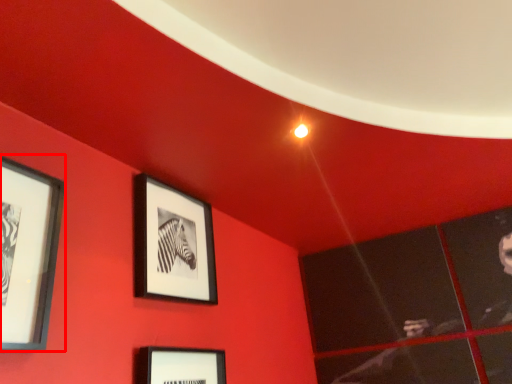
Question: From the image's perspective, what is the correct spatial relationship of picture frame (annotated by the red box) in relation to picture frame?

Choices:
 (A) above
 (B) below

Answer: (A)